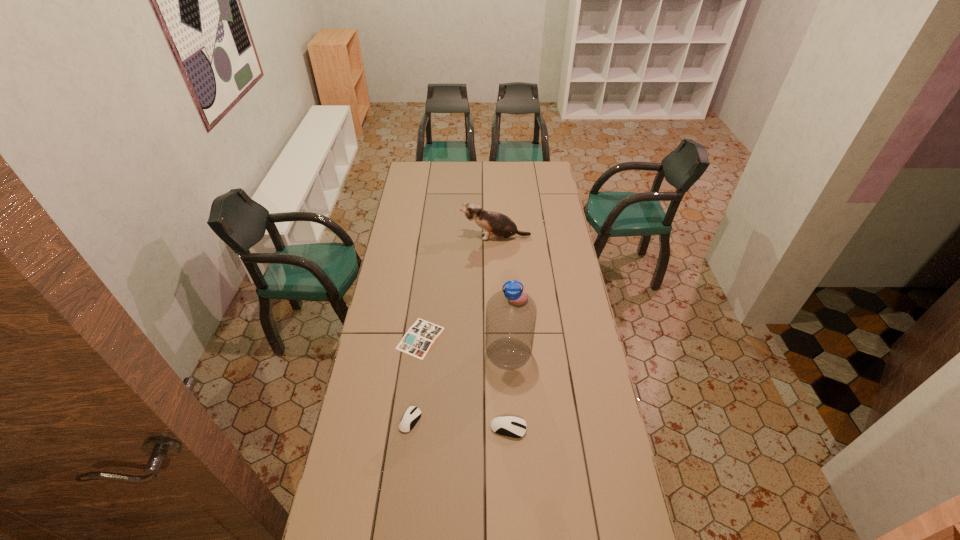
You are a GUI agent. You are given a task and a screenshot of the screen. Output one action in this format:
    pyautogui.click(x=<x>, y=<y>)
    Task: Click on the vacant point located at the face of the fifth shortest object
    
    Given the screenshot: What is the action you would take?
    coord(438,237)

Identify the location of vacant space situated at the face of the fifth shortest object. Image resolution: width=960 pixels, height=540 pixels. (405, 237).

Locate an element on the screen. The width and height of the screenshot is (960, 540). free point located at the face of the fifth shortest object is located at coordinates (417, 237).

Locate an element on the screen. This screenshot has width=960, height=540. free space located on the right of the shortest object is located at coordinates (516, 338).

This screenshot has height=540, width=960. Identify the location of vacant space positioned on the back of the tallest object. click(x=504, y=278).

Where is `object present at the left edge`? object present at the left edge is located at coordinates coord(420,337).

Locate an element on the screen. free spot at the far edge of the desktop is located at coordinates (444, 174).

The width and height of the screenshot is (960, 540). What are the coordinates of `free spot at the near edge of the desktop` in the screenshot? It's located at (550, 523).

Find the location of `vacant space at the left edge`. vacant space at the left edge is located at coordinates (394, 355).

Locate an element on the screen. vacant area at the right edge is located at coordinates (570, 436).